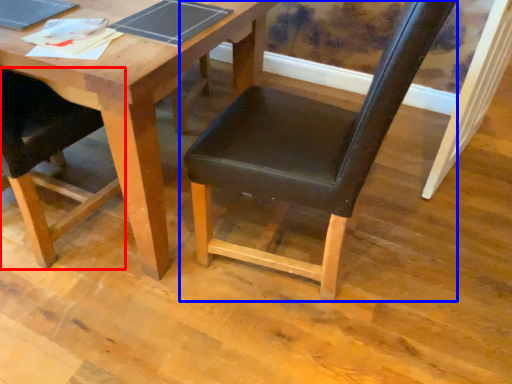
Question: Which object is closer to the camera taking this photo, chair (highlighted by a red box) or chair (highlighted by a blue box)?

Choices:
 (A) chair
 (B) chair

Answer: (B)